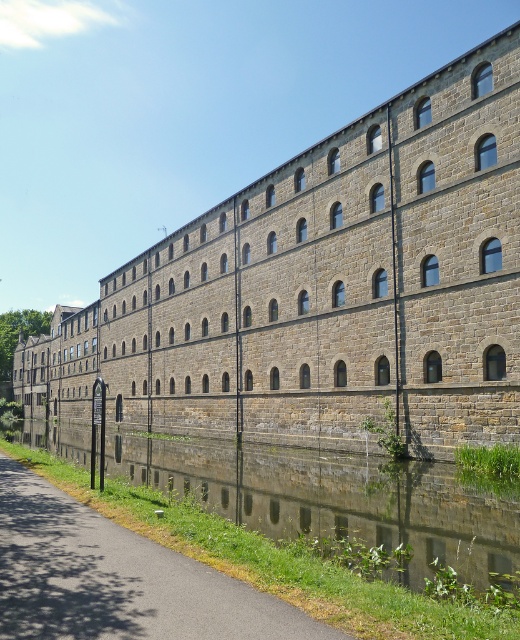
Is point (387, 304) farther from viewer compared to point (251, 602)?

Yes, point (387, 304) is farther from viewer.

What do you see at coordinates (325, 289) in the screenshot? I see `brown stone building at center` at bounding box center [325, 289].

Locate an element on the screen. Image resolution: width=520 pixels, height=640 pixels. brown stone building at center is located at coordinates (325, 289).

The width and height of the screenshot is (520, 640). What are the coordinates of `brown stone building at center` in the screenshot? It's located at (325, 289).